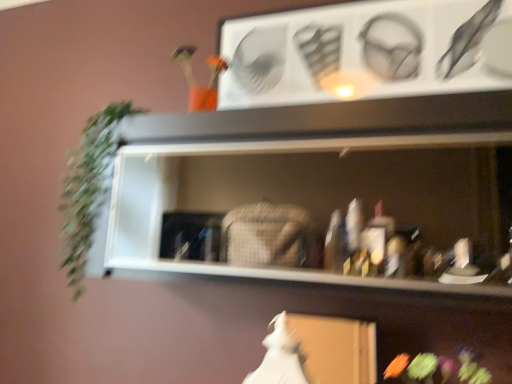
Question: Is fluffy fabric flower at lower right bigger or smaller than white matte fancy dress at lower center?

Choices:
 (A) big
 (B) small

Answer: (A)

Question: Is fluffy fabric flower at lower right taller or shorter than white matte fancy dress at lower center?

Choices:
 (A) tall
 (B) short

Answer: (B)

Question: Which is nearer to the fluffy fabric flower at lower right?

Choices:
 (A) white matte fancy dress at lower center
 (B) green leafy plant at left
 (C) white matte shelf at center

Answer: (A)

Question: Which is farther from the white matte fancy dress at lower center?

Choices:
 (A) green leafy plant at left
 (B) fluffy fabric flower at lower right
 (C) white matte shelf at center

Answer: (A)